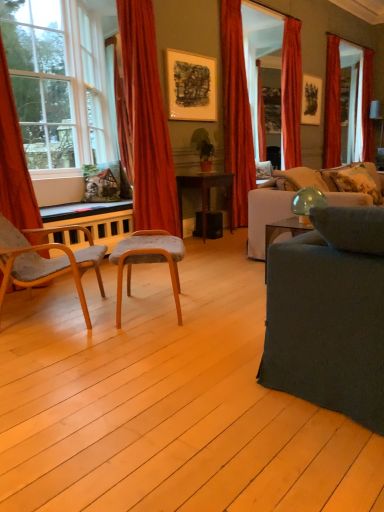
Find the location of a particular element. The image size is (384, 512). vacant space to the right of wooden chair at left, marked as the 1th chair in a left-to-right arrangement is located at coordinates (152, 328).